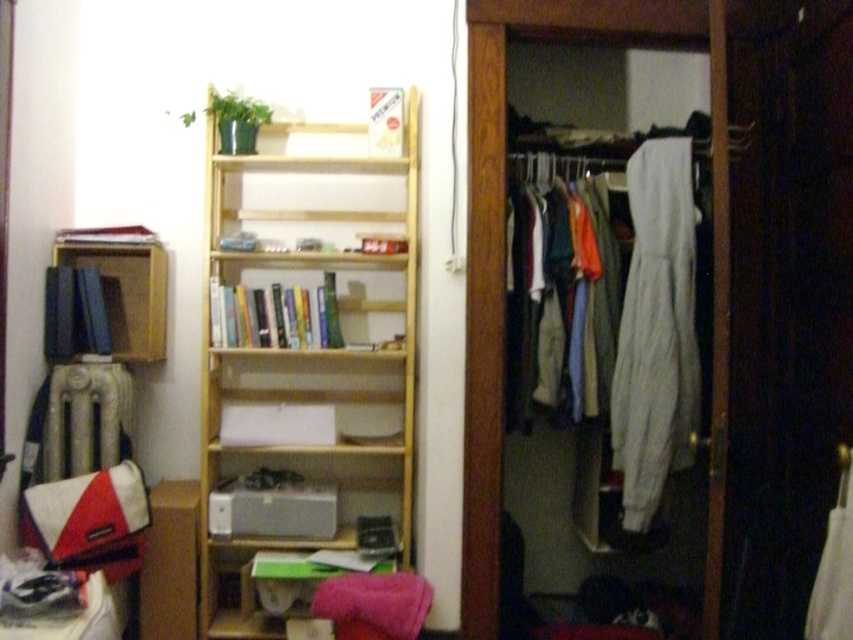
You are standing in the room and want to reach the point marked at coordinates (656, 330). Which object in the room is this point located on?

The point marked at coordinates (656, 330) is located on the white cotton hoodie at center.

You are standing in the room and want to hang a painting on the wall. The painting is 0.5 meters wide. The wall space between the white cotton hoodie at center and the radiator is 0.6 meters. Is there enough space to hang the painting there?

The wall space between the white cotton hoodie at center and the radiator is 0.6 meters, which is wider than the painting that is 0.5 meters wide. Therefore, there is enough space to hang the painting there.